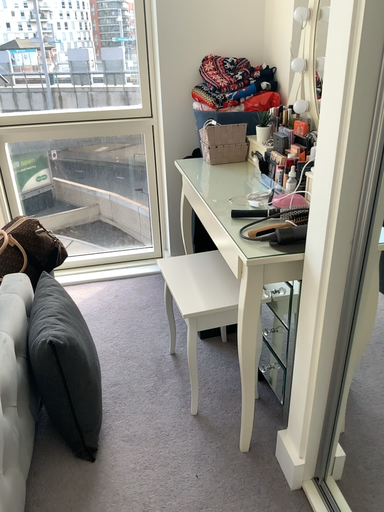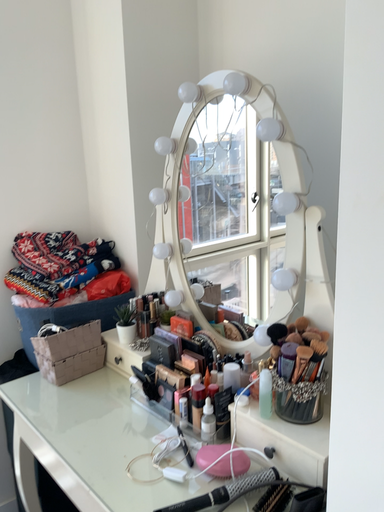
Question: How did the camera likely rotate when shooting the video?

Choices:
 (A) rotated left
 (B) rotated right

Answer: (B)